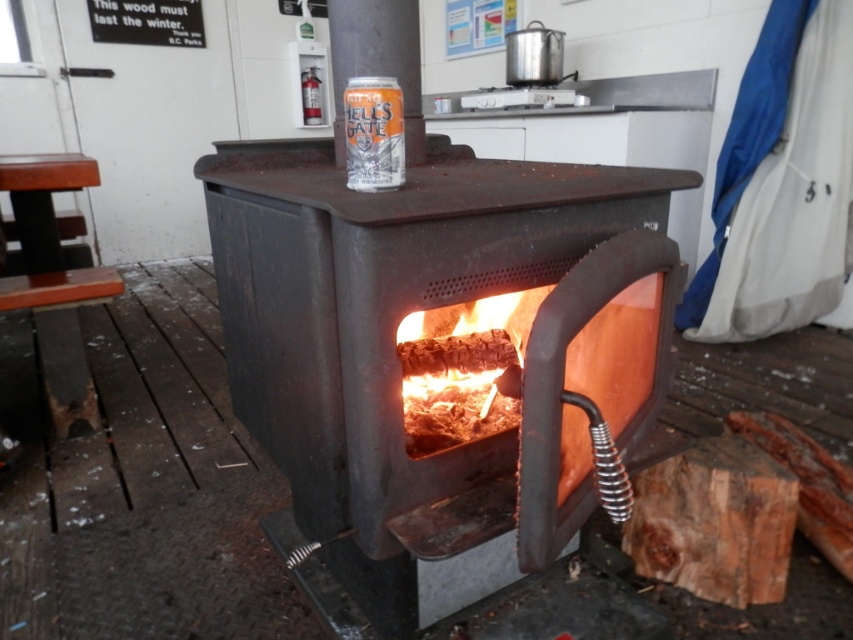
You are a delivery person who needs to place a package on the surface between the brown rough wood at lower right and the orange matte can at center. The package measures 12 inches in length. Can you fit it horizontally between them without moving either object?

The distance between the brown rough wood at lower right and the orange matte can at center is 35.86 inches. Since the package is only 12 inches long, it can easily fit horizontally between them without needing to move either object.

You are standing in front of the wood burning stove and want to place a small object on the surface between the two points labeled point (779, 512) and point (372, 180). Which point is closer to you so you can place the object there?

Point (372, 180) is closer to you than point (779, 512), so you should place the object near point (372, 180) to ensure it is within reach.